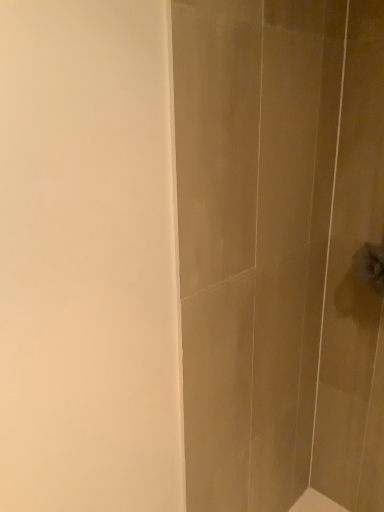
Locate an element on the screen. The width and height of the screenshot is (384, 512). matte glass screen door at center is located at coordinates (280, 250).

The height and width of the screenshot is (512, 384). Describe the element at coordinates (280, 250) in the screenshot. I see `matte glass screen door at center` at that location.

Where is `matte glass screen door at center`? This screenshot has width=384, height=512. matte glass screen door at center is located at coordinates (280, 250).